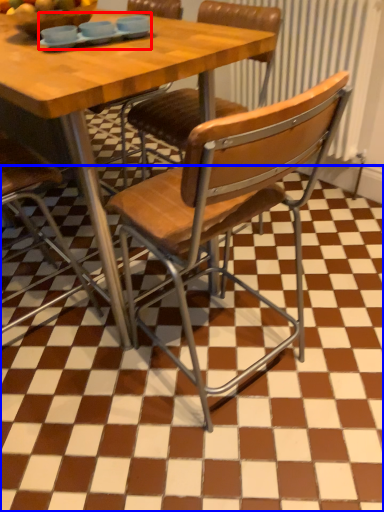
Question: Which object is closer to the camera taking this photo, tableware (highlighted by a red box) or tile (highlighted by a blue box)?

Choices:
 (A) tableware
 (B) tile

Answer: (B)